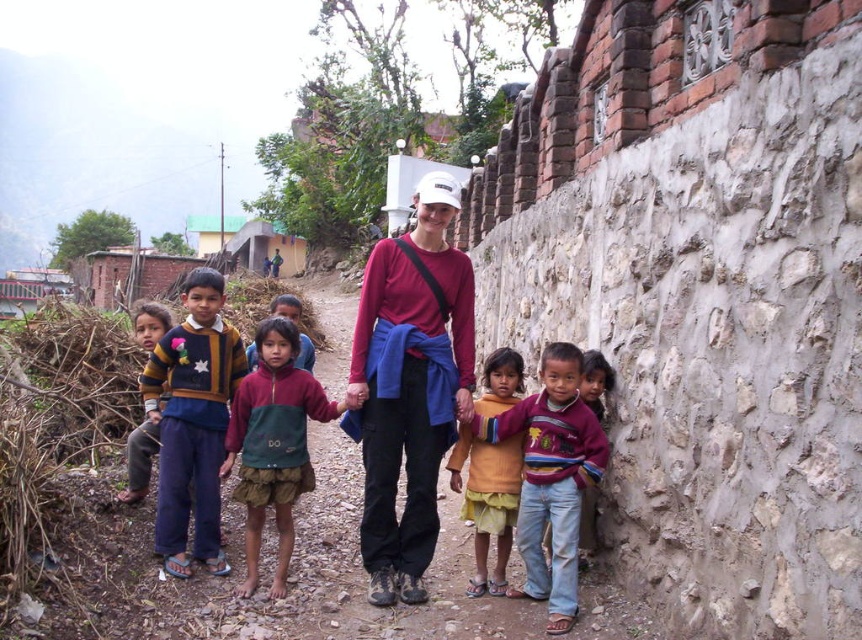
Question: Can you confirm if matte red shirt at center is thinner than knitted wool sweater at left?

Choices:
 (A) yes
 (B) no

Answer: (A)

Question: Which is farther from the blue cotton sweater at left?

Choices:
 (A) matte red shirt at center
 (B) green fabric skirt at center
 (C) knitted wool sweater at left

Answer: (A)

Question: Does multicolored sweater at center come in front of green fabric skirt at center?

Choices:
 (A) no
 (B) yes

Answer: (B)

Question: Can you confirm if striped sweater at lower right is bigger than orange cotton dress at lower center?

Choices:
 (A) yes
 (B) no

Answer: (A)

Question: Estimate the real-world distances between objects in this image. Which object is farther from the blue cotton sweater at left?

Choices:
 (A) striped sweater at lower right
 (B) multicolored sweater at center
 (C) knitted wool sweater at left
 (D) matte red shirt at center

Answer: (A)

Question: Considering the real-world distances, which object is closest to the green fabric dress at center?

Choices:
 (A) orange cotton dress at lower center
 (B) green fabric skirt at center

Answer: (B)